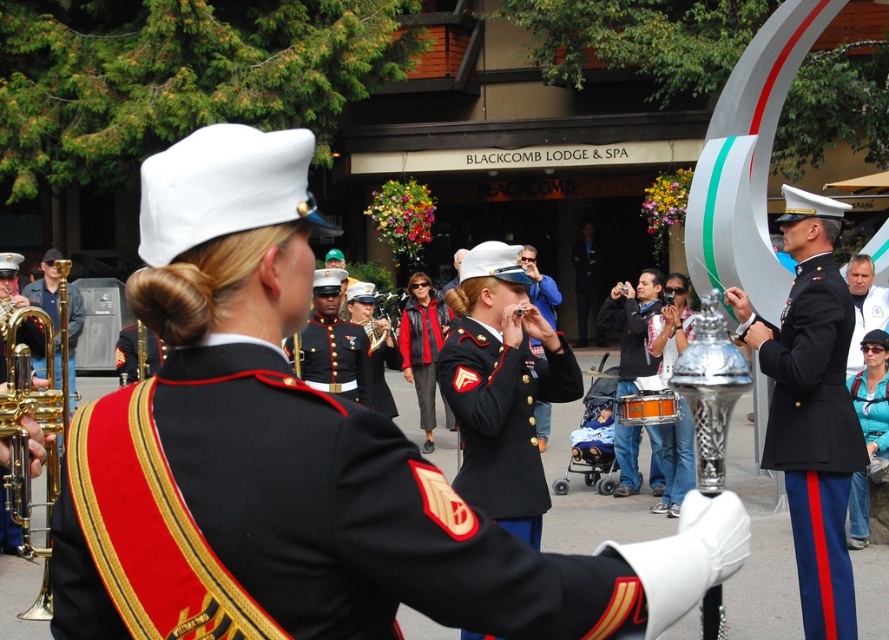
You are a photographer trying to capture the military band members in the scene. You notice the dark blue uniform at center and the shiny black uniform at center. Which uniform is positioned higher in the image?

The dark blue uniform at center is located above the shiny black uniform at center, so it is positioned higher in the image.

You are standing in the crowd watching the military band performance. There is a point marked at coordinates (631, 324) in the image. What object is located at this point?

The point at coordinates (631, 324) marks the orange drum at center.